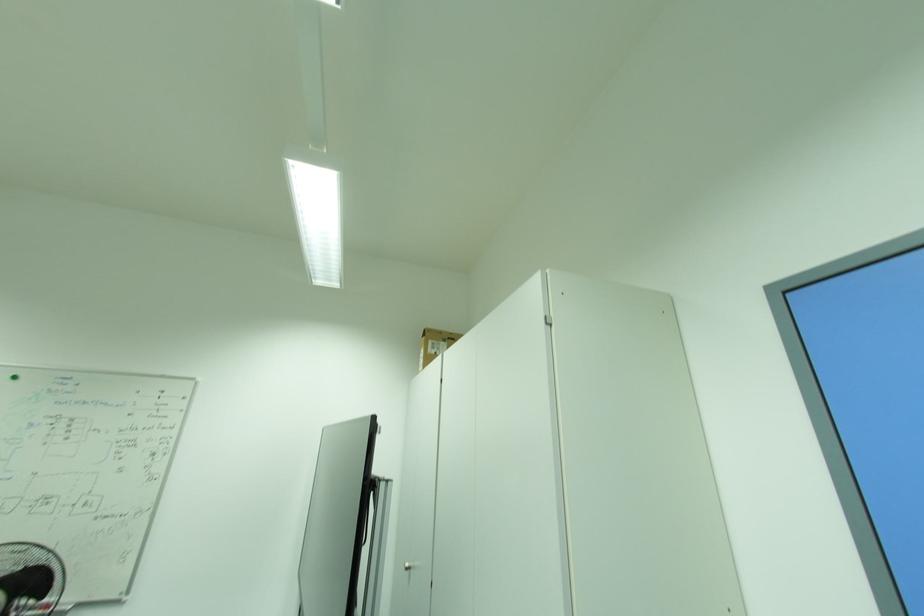
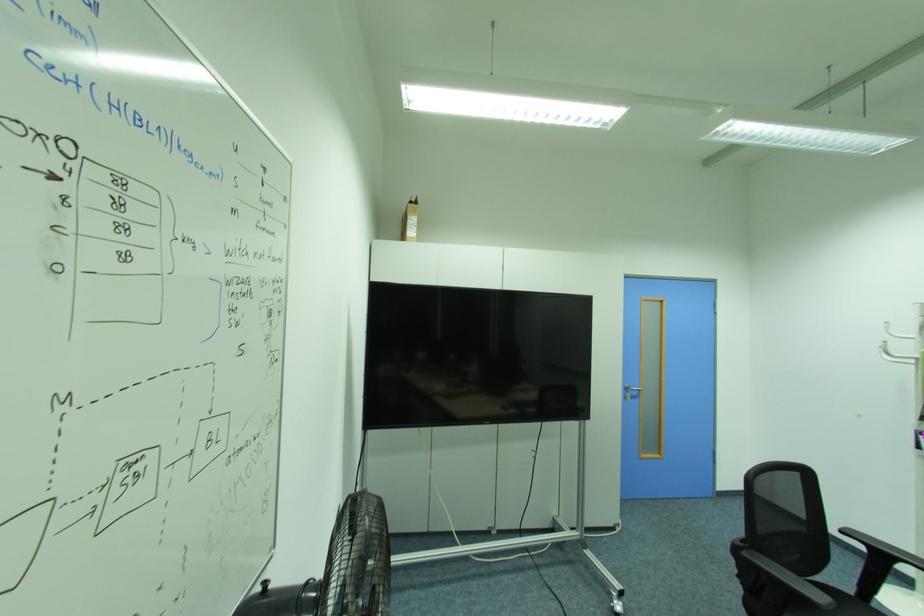
Locate, in the second image, the point that corresponds to point (420, 373) in the first image.

(407, 237)